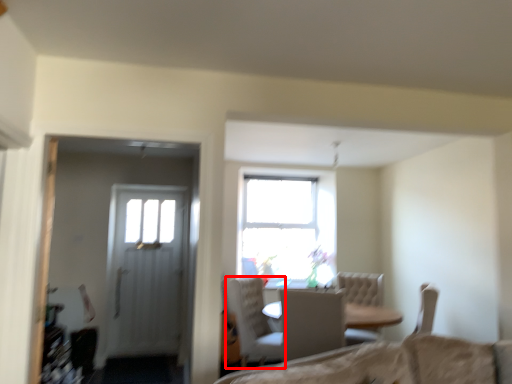
Question: From the image's perspective, what is the correct spatial relationship of chair (annotated by the red box) in relation to chair?

Choices:
 (A) below
 (B) above

Answer: (A)